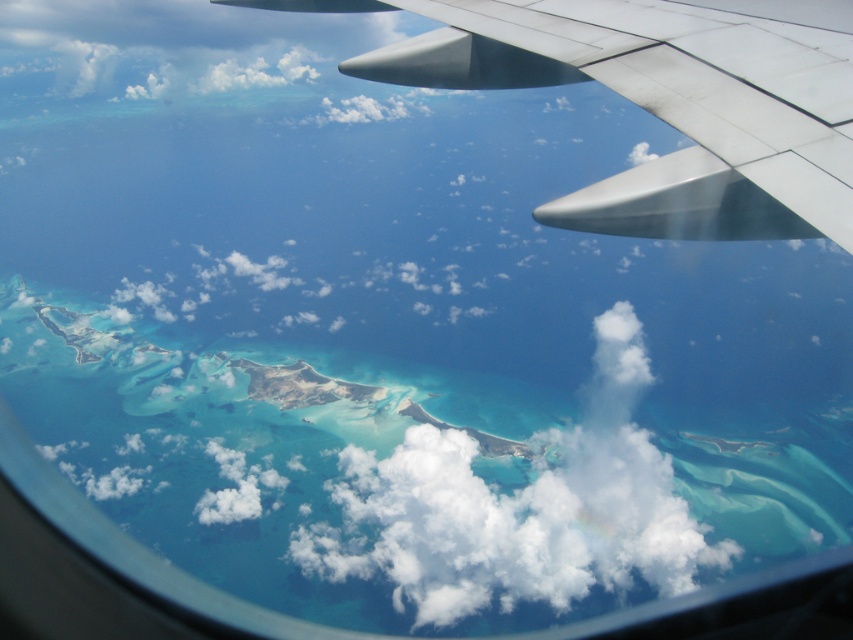
Can you confirm if metallic silver wing at upper right is positioned above white fluffy cloud at center?

Yes, metallic silver wing at upper right is above white fluffy cloud at center.

Does metallic silver wing at upper right have a lesser height compared to white fluffy cloud at center?

Yes, metallic silver wing at upper right is shorter than white fluffy cloud at center.

Identify the location of metallic silver wing at upper right. Image resolution: width=853 pixels, height=640 pixels. (660, 102).